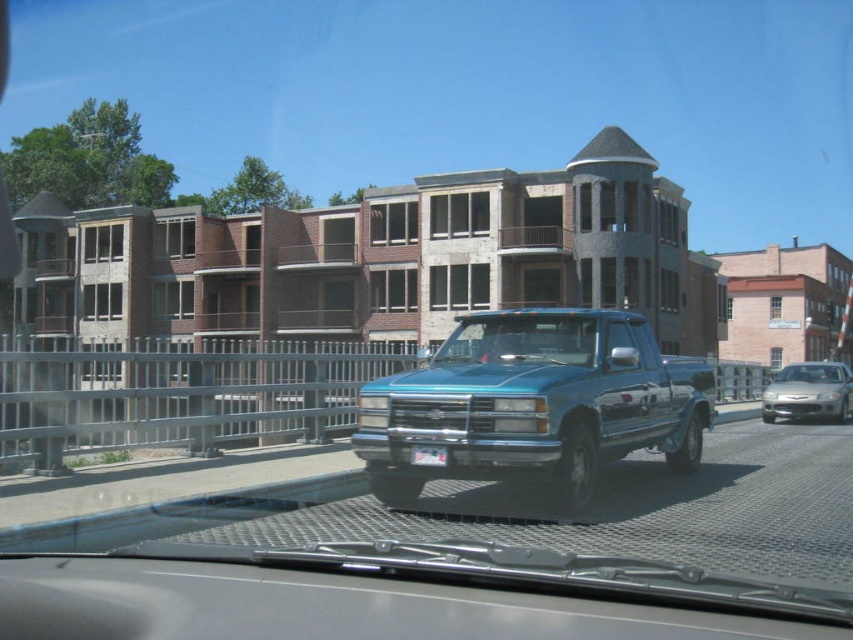
You are inside a car and want to know how far you are from the point marked at coordinates point (809, 397). Can you determine the distance?

The distance between you and point (809, 397) is 67.41 feet.

You are in a car and looking out the windshield. You see a point marked at coordinates (x=809, y=392). What object is located at that point?

The point at coordinates (x=809, y=392) indicates a silver metallic sedan at right.

From the picture: You are a delivery driver who needs to park your truck in a parking spot that is exactly the width of the white plastic license plate at center. Can your metallic blue pickup truck at center fit into this parking spot?

The metallic blue pickup truck at center is narrower than the white plastic license plate at center, so it can fit into the parking spot.